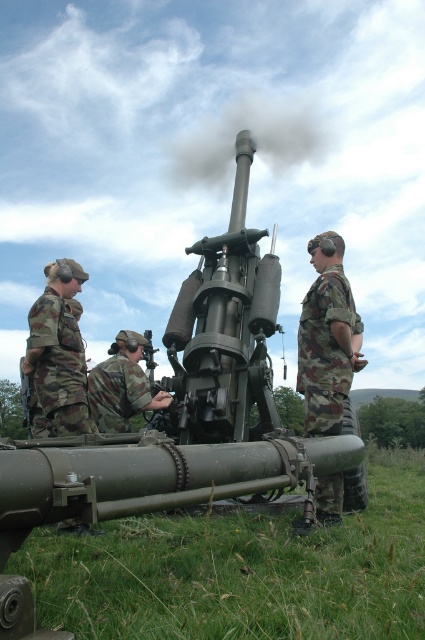
Question: Which point is farther to the camera?

Choices:
 (A) (323, 333)
 (B) (95, 385)
 (C) (189, 477)
 (D) (85, 385)

Answer: (B)

Question: Which point is farther from the camera taking this photo?

Choices:
 (A) [340, 300]
 (B) [59, 369]
 (C) [156, 400]

Answer: (C)

Question: Does camo fabric soldier at center lie behind camouflage fabric uniform at center?

Choices:
 (A) no
 (B) yes

Answer: (A)

Question: Does camouflage uniform at left appear under camouflage fabric uniform at center?

Choices:
 (A) no
 (B) yes

Answer: (A)

Question: Estimate the real-world distances between objects in this image. Which object is closer to the matte green cannon at center?

Choices:
 (A) camo fabric soldier at center
 (B) camouflage fabric uniform at center
 (C) camouflage uniform at left

Answer: (B)

Question: In this image, where is camo fabric soldier at center located relative to camouflage uniform at left?

Choices:
 (A) left
 (B) right

Answer: (B)